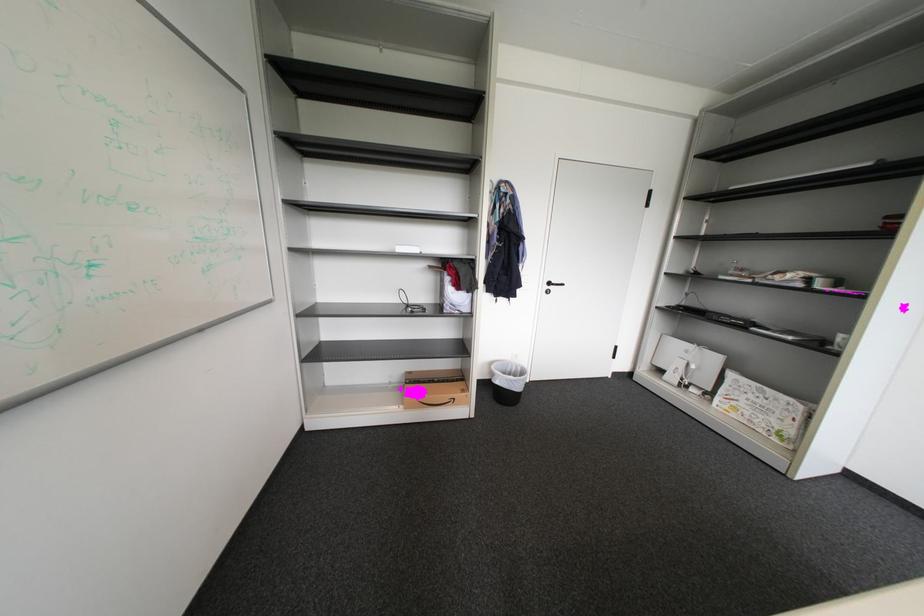
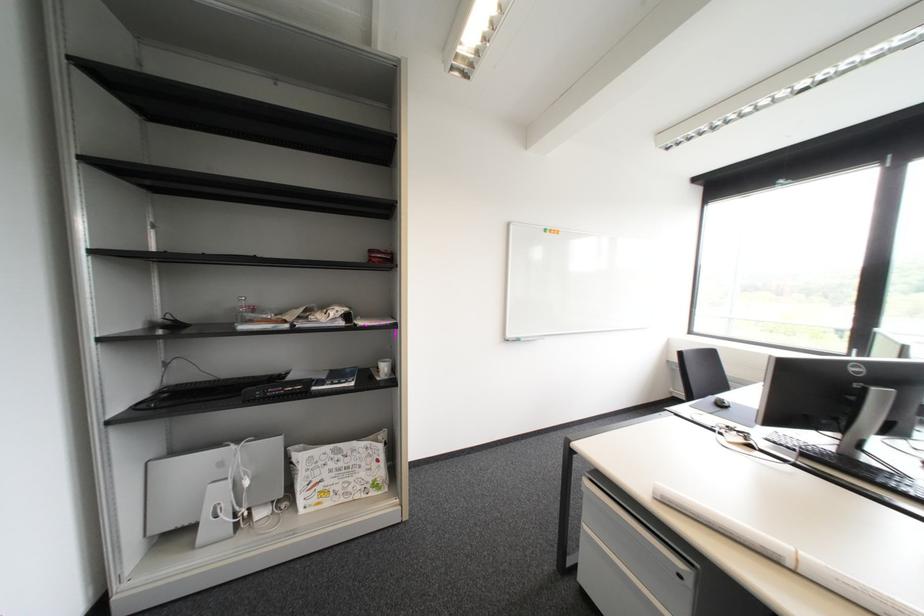
Locate, in the second image, the point that corresponds to the point at 845,336 in the first image.

(387, 366)